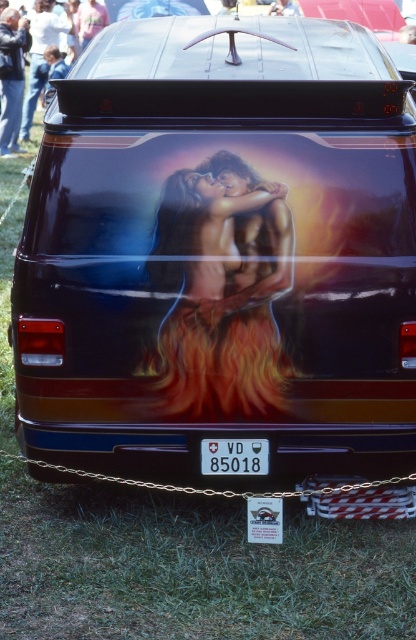
You are standing in front of the van and want to touch both the flaming orange hair at center and the dark blue jeans at upper left. Which object will your hand reach first?

The flaming orange hair at center will be reached first because it is closer to the viewer than the dark blue jeans at upper left.

You are a delivery person who needs to attach a package label to either the dark blue jeans at upper left or the white plastic license plate at center. Which object is wider so you can choose the better surface for the label?

The dark blue jeans at upper left is wider than the white plastic license plate at center, so you should choose the dark blue jeans at upper left as the better surface for the label.